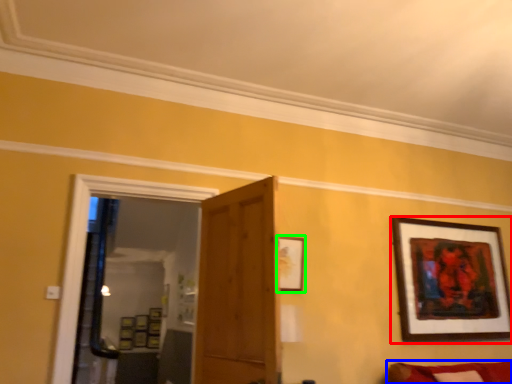
Question: Based on their relative distances, which object is farther from picture frame (highlighted by a red box)? Choose from couch (highlighted by a blue box) and picture frame (highlighted by a green box).

Choices:
 (A) couch
 (B) picture frame

Answer: (B)